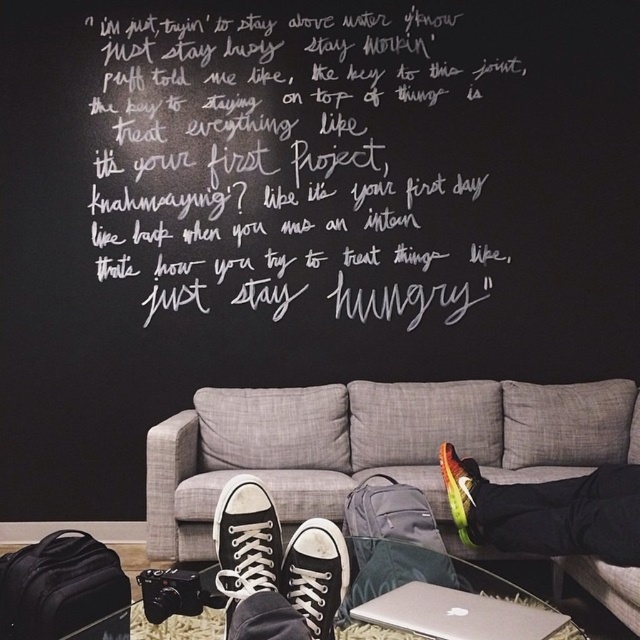
Question: Can you confirm if white chalk writing at upper center is positioned to the left of white canvas shoe at center?

Choices:
 (A) no
 (B) yes

Answer: (A)

Question: Which point is farther from the camera taking this photo?

Choices:
 (A) (467, 595)
 (B) (451, 476)
 (C) (326, 540)
 (D) (252, 493)

Answer: (B)

Question: Which of the following is the farthest from the observer?

Choices:
 (A) multicolored fabric sneaker at lower right
 (B) neon yellow and black sneakers at lower right
 (C) black canvas shoe at lower center

Answer: (A)

Question: Can you confirm if gray fabric couch at center is smaller than silver metallic laptop at center?

Choices:
 (A) yes
 (B) no

Answer: (B)

Question: Among these objects, which one is farthest from the camera?

Choices:
 (A) gray fabric couch at center
 (B) neon yellow and black sneakers at lower right

Answer: (A)

Question: Is the position of white chalk writing at upper center less distant than that of neon yellow and black sneakers at lower right?

Choices:
 (A) no
 (B) yes

Answer: (A)